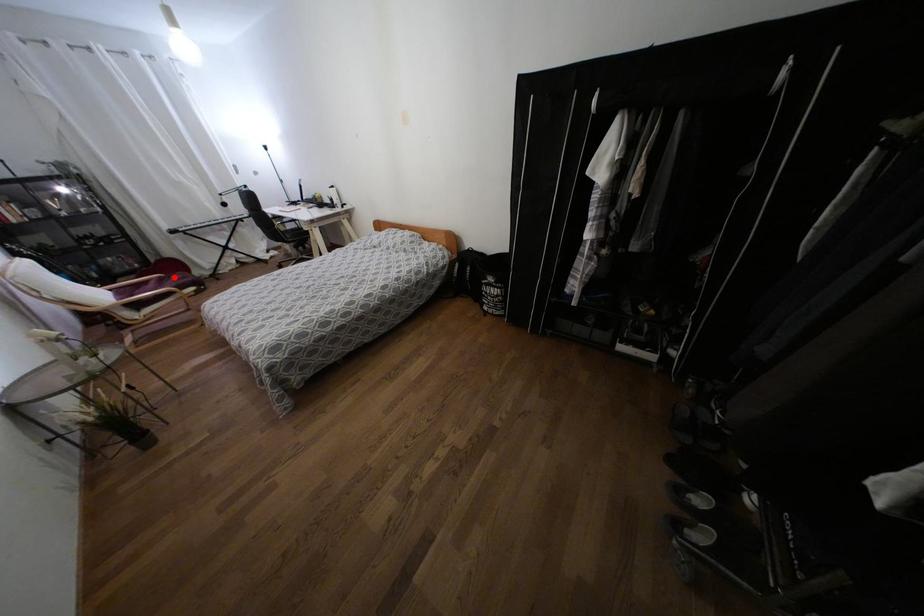
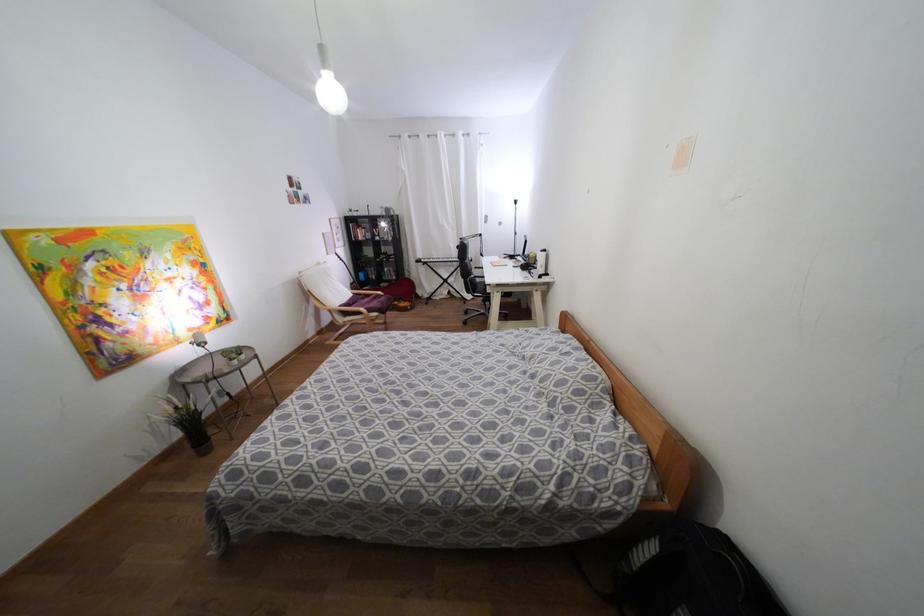
Question: I am providing you with two images of the same scene from different viewpoints. In image1, a red point is highlighted. Considering the same 3D point in image2, which of the following is correct?

Choices:
 (A) It is closer
 (B) It is farther

Answer: (A)